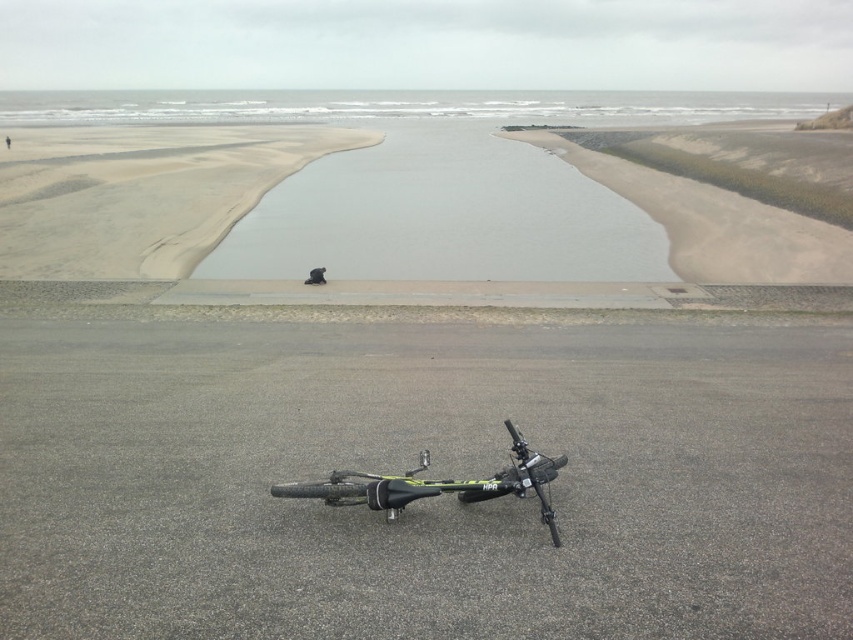
Question: Observing the image, what is the correct spatial positioning of sandy at lower left in reference to yellow-green matte mountain bike at lower center?

Choices:
 (A) right
 (B) left

Answer: (B)

Question: Among these points, which one is nearest to the camera?

Choices:
 (A) (109, 195)
 (B) (10, 106)
 (C) (544, 502)

Answer: (C)

Question: Is sandy at lower left thinner than yellow-green matte mountain bike at lower center?

Choices:
 (A) yes
 (B) no

Answer: (B)

Question: Which object is the closest to the sandy at lower left?

Choices:
 (A) gray water at upper center
 (B) yellow-green matte mountain bike at lower center

Answer: (B)

Question: Can you confirm if sandy at lower left is smaller than yellow-green matte mountain bike at lower center?

Choices:
 (A) no
 (B) yes

Answer: (A)

Question: Which of the following is the farthest from the observer?

Choices:
 (A) (207, 112)
 (B) (376, 481)
 (C) (178, 244)

Answer: (A)